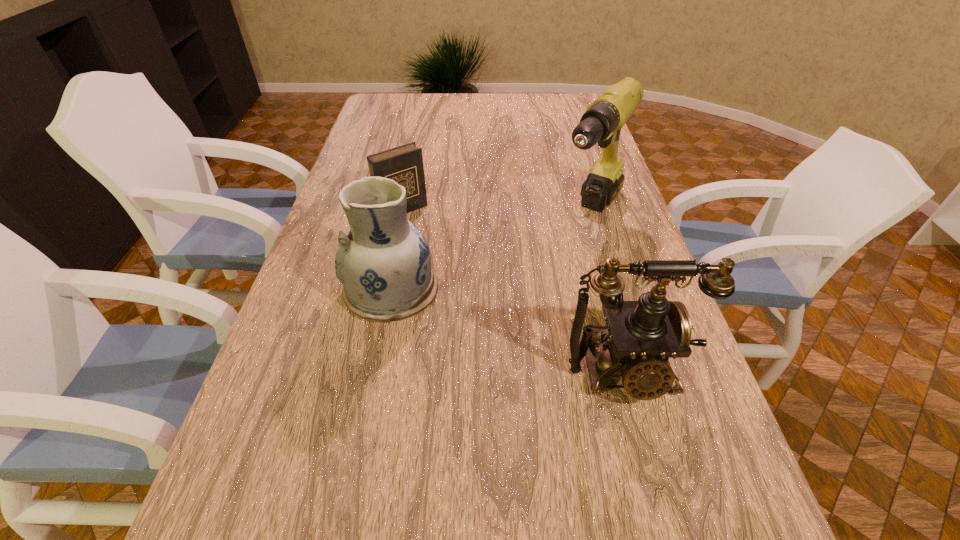
Where is `pottery`? The width and height of the screenshot is (960, 540). pottery is located at coordinates (383, 261).

Image resolution: width=960 pixels, height=540 pixels. What are the coordinates of `the nearest object` in the screenshot? It's located at (642, 335).

I want to click on drill, so click(x=602, y=122).

What are the coordinates of `diary` in the screenshot? It's located at (404, 164).

This screenshot has width=960, height=540. I want to click on free space located on the left of the pottery, so pyautogui.click(x=300, y=289).

Where is `free spot located 0.060m on the rotary dial of the nearest object`? This screenshot has height=540, width=960. free spot located 0.060m on the rotary dial of the nearest object is located at coordinates (643, 440).

Locate an element on the screen. The width and height of the screenshot is (960, 540). vacant area situated 0.340m on the handle side of the drill is located at coordinates (516, 322).

At what (x,y) coordinates should I click in order to perform the action: click on free space located on the handle side of the drill. Please return your answer as a coordinate pair (x, y). Looking at the image, I should click on (529, 306).

The width and height of the screenshot is (960, 540). I want to click on vacant region located 0.340m on the handle side of the drill, so click(x=516, y=322).

The image size is (960, 540). Identify the location of vacant space located 0.290m on the front cover of the shortest object. (468, 277).